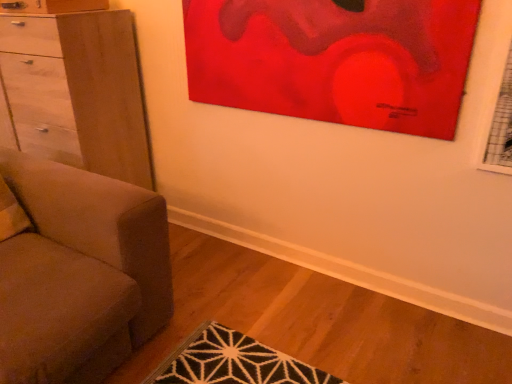
Question: In the image, is light brown wood chest of drawers at left positioned in front of or behind matte red painting at upper center?

Choices:
 (A) behind
 (B) front

Answer: (A)

Question: Is light brown wood chest of drawers at left inside the boundaries of matte red painting at upper center, or outside?

Choices:
 (A) outside
 (B) inside

Answer: (A)

Question: Which of these objects is positioned closest to the matte red painting at upper center?

Choices:
 (A) light brown wood chest of drawers at left
 (B) matte gray couch at left

Answer: (A)

Question: Which object is positioned farthest from the light brown wood chest of drawers at left?

Choices:
 (A) matte gray couch at left
 (B) matte red painting at upper center

Answer: (B)